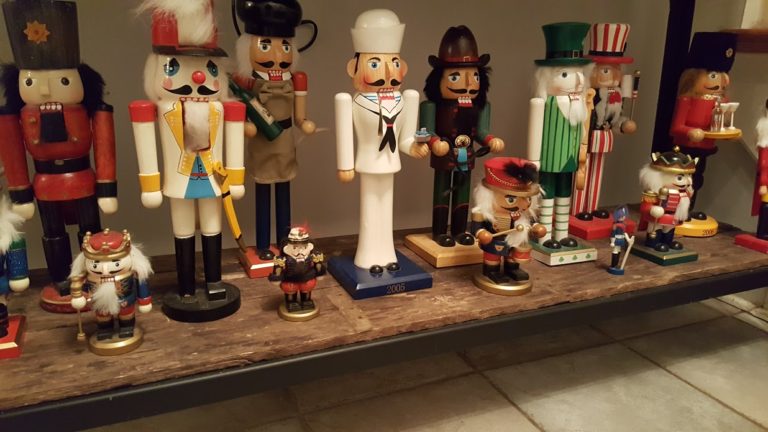
The width and height of the screenshot is (768, 432). What are the coordinates of `wine and glasses` in the screenshot? It's located at (717, 116), (727, 105), (732, 111).